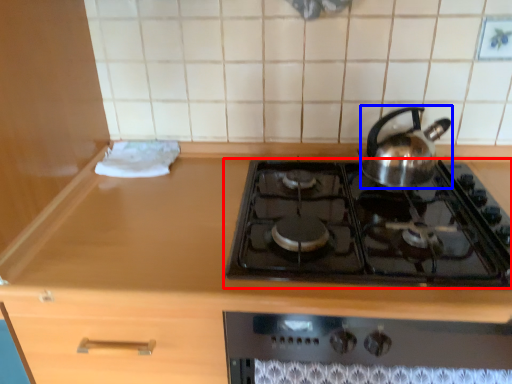
Question: Which object is further to the camera taking this photo, gas stove (highlighted by a red box) or kettle (highlighted by a blue box)?

Choices:
 (A) gas stove
 (B) kettle

Answer: (B)